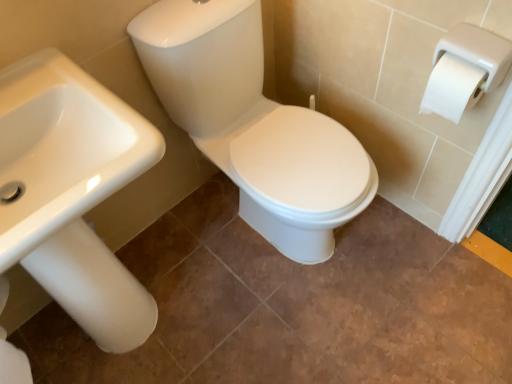
Measure the distance between point (331, 234) and camera.

Point (331, 234) and camera are 4.63 feet apart from each other.

The height and width of the screenshot is (384, 512). What are the coordinates of `white glossy toilet seat at center` in the screenshot? It's located at [x=254, y=125].

Describe the element at coordinates (254, 125) in the screenshot. The image size is (512, 384). I see `white glossy toilet seat at center` at that location.

Find the location of `white glossy sink at left`. white glossy sink at left is located at coordinates (72, 192).

This screenshot has height=384, width=512. What do you see at coordinates (72, 192) in the screenshot? I see `white glossy sink at left` at bounding box center [72, 192].

At what (x,y) coordinates should I click in order to perform the action: click on white glossy toilet seat at center. Please return your answer as a coordinate pair (x, y). The height and width of the screenshot is (384, 512). Looking at the image, I should click on (254, 125).

Which is more to the right, white glossy toilet seat at center or white glossy sink at left?

From the viewer's perspective, white glossy toilet seat at center appears more on the right side.

Which object is closer to the camera, white glossy toilet seat at center or white glossy sink at left?

Positioned in front is white glossy sink at left.

Is point (189, 126) closer to viewer compared to point (119, 106)?

No, it is behind (119, 106).

From the image's perspective, between white glossy toilet seat at center and white glossy sink at left, which one is located above?

From the image's view, white glossy toilet seat at center is above.

From a real-world perspective, is white glossy toilet seat at center over white glossy sink at left?

No, from a real-world perspective, white glossy toilet seat at center is not above white glossy sink at left.

Considering the relative sizes of white glossy toilet seat at center and white glossy sink at left in the image provided, is white glossy toilet seat at center thinner than white glossy sink at left?

Incorrect, the width of white glossy toilet seat at center is not less than that of white glossy sink at left.

Which of these two, white glossy toilet seat at center or white glossy sink at left, stands taller?

Standing taller between the two is white glossy sink at left.

Considering the sizes of objects white glossy toilet seat at center and white glossy sink at left in the image provided, who is bigger, white glossy toilet seat at center or white glossy sink at left?

white glossy toilet seat at center is bigger.

Can white glossy sink at left be found inside white glossy toilet seat at center?

No, white glossy sink at left is not a part of white glossy toilet seat at center.

Is white glossy toilet seat at center next to white glossy sink at left and touching it?

No, white glossy toilet seat at center is not next to white glossy sink at left.

Is white glossy toilet seat at center turned away from white glossy sink at left?

No, white glossy sink at left is not at the back of white glossy toilet seat at center.

How many degrees apart are the facing directions of white glossy toilet seat at center and white glossy sink at left?

The angle between the facing direction of white glossy toilet seat at center and the facing direction of white glossy sink at left is 1.53 degrees.

I want to click on sink that appears in front of the white glossy toilet seat at center, so click(x=72, y=192).

Which is more to the right, white glossy sink at left or white glossy toilet seat at center?

white glossy toilet seat at center.

Considering their positions, is white glossy sink at left located in front of or behind white glossy toilet seat at center?

white glossy sink at left is positioned closer to the viewer than white glossy toilet seat at center.

Is point (112, 190) positioned before point (246, 83)?

Yes, point (112, 190) is in front of point (246, 83).

In the scene shown: From the image's perspective, is white glossy sink at left below white glossy toilet seat at center?

Indeed, from the image's perspective, white glossy sink at left is shown beneath white glossy toilet seat at center.

From a real-world perspective, is white glossy sink at left over white glossy toilet seat at center?

Yes, from a real-world perspective, white glossy sink at left is above white glossy toilet seat at center.

Between white glossy sink at left and white glossy toilet seat at center, which one has smaller width?

Thinner between the two is white glossy sink at left.

Considering the relative sizes of white glossy sink at left and white glossy toilet seat at center in the image provided, is white glossy sink at left shorter than white glossy toilet seat at center?

In fact, white glossy sink at left may be taller than white glossy toilet seat at center.

Is white glossy sink at left smaller than white glossy toilet seat at center?

Correct, white glossy sink at left occupies less space than white glossy toilet seat at center.

Which is correct: white glossy sink at left is inside white glossy toilet seat at center, or outside of it?

white glossy sink at left lies outside white glossy toilet seat at center.

Is white glossy sink at left touching white glossy toilet seat at center?

There is a gap between white glossy sink at left and white glossy toilet seat at center.

Is white glossy sink at left turned away from white glossy toilet seat at center?

white glossy sink at left is not turned away from white glossy toilet seat at center.

Image resolution: width=512 pixels, height=384 pixels. In order to click on sink on the left of white glossy toilet seat at center in this screenshot , I will do `click(72, 192)`.

Identify the location of sit that appears below the white glossy sink at left (from a real-world perspective). Image resolution: width=512 pixels, height=384 pixels. (254, 125).

The image size is (512, 384). Find the location of `sink located in front of the white glossy toilet seat at center`. sink located in front of the white glossy toilet seat at center is located at coordinates (72, 192).